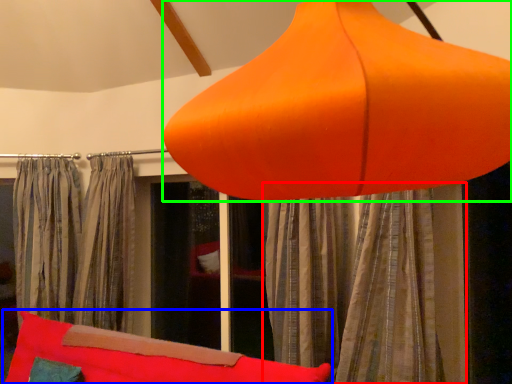
Question: Which object is the farthest from curtain (highlighted by a red box)? Choose among these: bean bag chair (highlighted by a blue box) or lamp (highlighted by a green box).

Choices:
 (A) bean bag chair
 (B) lamp

Answer: (B)